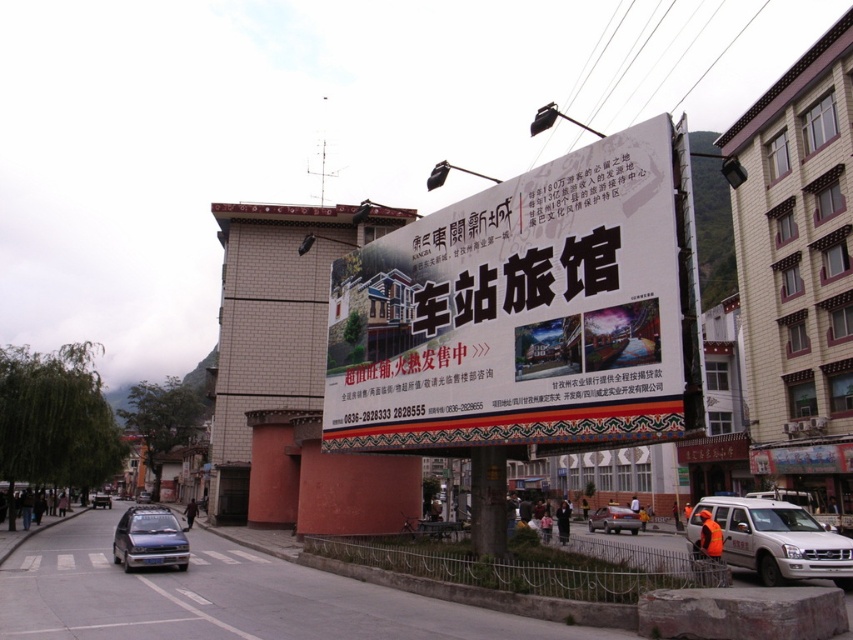
Does white paper billboard at center have a lesser width compared to white matte van at lower right?

Incorrect, white paper billboard at center's width is not less than white matte van at lower right's.

Who is more forward, (363, 397) or (819, 561)?

Point (819, 561) is more forward.

This screenshot has width=853, height=640. In order to click on white paper billboard at center in this screenshot , I will do `click(517, 312)`.

Does white paper billboard at center have a greater height compared to blue metallic car at center?

Yes, white paper billboard at center is taller than blue metallic car at center.

Is point (517, 417) positioned behind point (109, 508)?

No, it is in front of (109, 508).

Identify the location of white paper billboard at center. (517, 312).

Does white matte van at lower right come in front of metallic blue sedan at lower left?

Yes, white matte van at lower right is closer to the viewer.

Who is shorter, white matte van at lower right or metallic blue sedan at lower left?

Standing shorter between the two is white matte van at lower right.

The image size is (853, 640). Find the location of `white matte van at lower right`. white matte van at lower right is located at coordinates (775, 540).

Image resolution: width=853 pixels, height=640 pixels. Identify the location of white matte van at lower right. (775, 540).